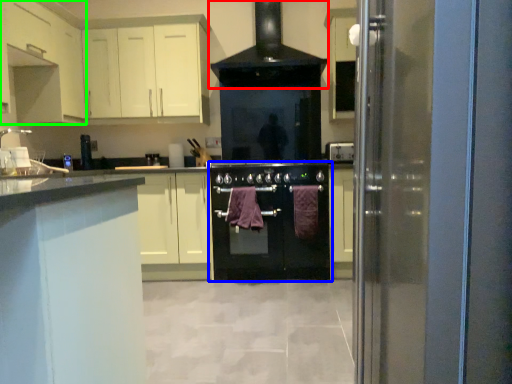
Question: Which object is positioned closest to home appliance (highlighted by a red box)? Select from oven (highlighted by a blue box) and cabinetry (highlighted by a green box).

Choices:
 (A) oven
 (B) cabinetry

Answer: (A)